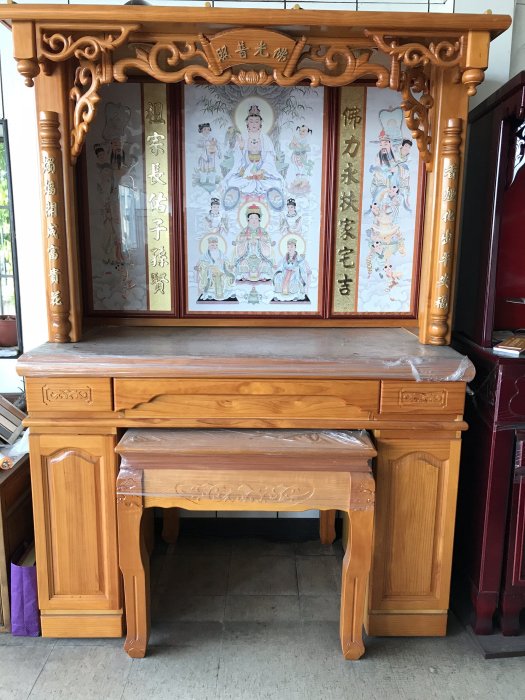
Identify the location of center glass panel. coord(250,178).